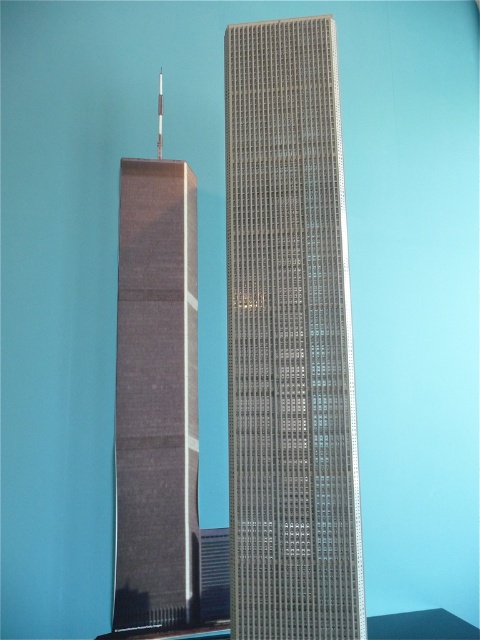
Does sleek glass skyscraper at center appear under matte gray tower at left?

Actually, sleek glass skyscraper at center is above matte gray tower at left.

Is sleek glass skyscraper at center closer to the viewer compared to matte gray tower at left?

That is True.

Describe the element at coordinates (288, 339) in the screenshot. I see `sleek glass skyscraper at center` at that location.

Where is `sleek glass skyscraper at center`? This screenshot has height=640, width=480. sleek glass skyscraper at center is located at coordinates (288, 339).